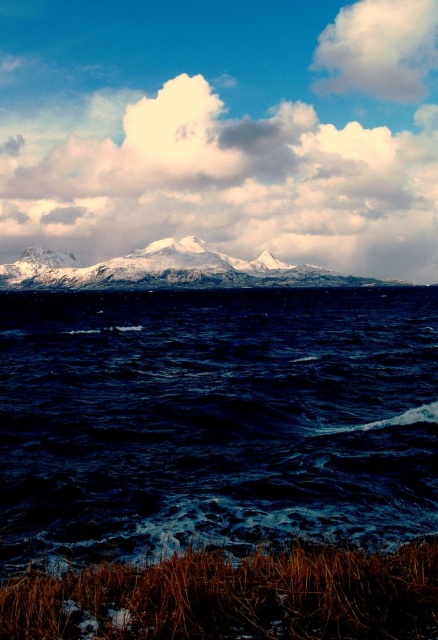
You are an artist painting this coastal scene. You want to ensure the snowy rock mountain at upper center and the white fluffy cloud at upper right are proportionally accurate. Which one should you draw smaller in your painting?

The snowy rock mountain at upper center should be drawn smaller than the white fluffy cloud at upper right because the snowy rock mountain at upper center is not as tall as the white fluffy cloud at upper right.

You are standing at the shoreline with dry, golden brown grasses in the foreground. You want to reach the dark blue water at center. Which direction should you move in to get there?

The dark blue water at center is located at point (215, 419), so you should move forward towards the center of the image to reach it.